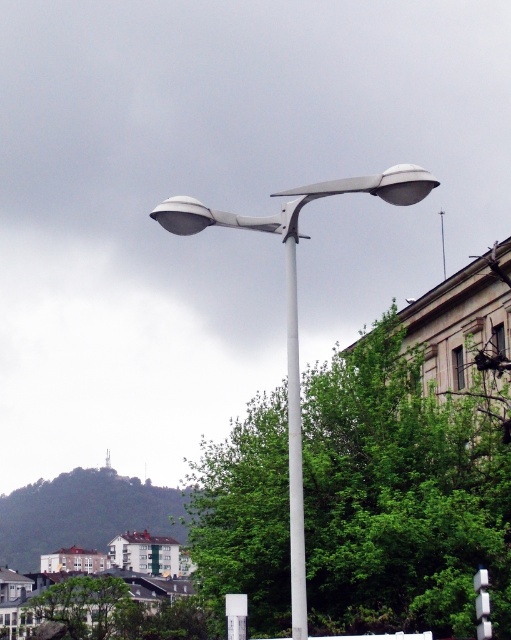
Question: Among these points, which one is farthest from the camera?

Choices:
 (A) (295, 243)
 (B) (482, 570)
 (C) (292, 552)

Answer: (B)

Question: Which of the following is the farthest from the observer?

Choices:
 (A) white smooth pole at center
 (B) white glossy street light at center
 (C) white plastic sign at center

Answer: (C)

Question: Does white glossy street light at center have a larger size compared to white smooth pole at center?

Choices:
 (A) no
 (B) yes

Answer: (B)

Question: Is white smooth pole at center behind white plastic sign at center?

Choices:
 (A) no
 (B) yes

Answer: (A)

Question: Is white smooth pole at center wider than white plastic sign at center?

Choices:
 (A) no
 (B) yes

Answer: (B)

Question: Which object is farther from the camera taking this photo?

Choices:
 (A) white plastic sign at center
 (B) white glossy street light at center

Answer: (A)